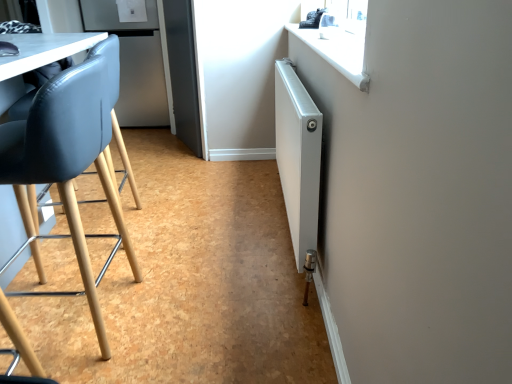
I want to click on satin silver refrigerator at upper left, so click(134, 62).

Locate an element on the screen. The width and height of the screenshot is (512, 384). satin silver refrigerator at upper left is located at coordinates (134, 62).

From the picture: Can you confirm if matte black chair at left is thinner than white metallic radiator at right?

In fact, matte black chair at left might be wider than white metallic radiator at right.

Find the location of `chair lying on the left of white metallic radiator at right`. chair lying on the left of white metallic radiator at right is located at coordinates (68, 159).

From the image's perspective, would you say matte black chair at left is positioned over white metallic radiator at right?

Incorrect, from the image's perspective, matte black chair at left is lower than white metallic radiator at right.

From a real-world perspective, is matte black chair at left above or below white metallic radiator at right?

matte black chair at left is above white metallic radiator at right.

How distant is satin silver refrigerator at upper left from white metallic radiator at right?

The distance of satin silver refrigerator at upper left from white metallic radiator at right is 6.09 feet.

Considering the relative sizes of satin silver refrigerator at upper left and white metallic radiator at right in the image provided, is satin silver refrigerator at upper left smaller than white metallic radiator at right?

Actually, satin silver refrigerator at upper left might be larger than white metallic radiator at right.

Is white metallic radiator at right a part of satin silver refrigerator at upper left?

Definitely not — white metallic radiator at right is not inside satin silver refrigerator at upper left.

Relative to white metallic radiator at right, is satin silver refrigerator at upper left in front or behind?

Visually, satin silver refrigerator at upper left is located behind white metallic radiator at right.

Is white metallic radiator at right not within satin silver refrigerator at upper left?

Yes.

Locate an element on the screen. This screenshot has width=512, height=384. radiator that is on the right side of satin silver refrigerator at upper left is located at coordinates (298, 157).

Is white metallic radiator at right far away from satin silver refrigerator at upper left?

Absolutely, white metallic radiator at right is distant from satin silver refrigerator at upper left.

Considering the sizes of white metallic radiator at right and satin silver refrigerator at upper left in the image, is white metallic radiator at right wider or thinner than satin silver refrigerator at upper left?

Clearly, white metallic radiator at right has less width compared to satin silver refrigerator at upper left.

Is white metallic radiator at right directly adjacent to matte black chair at left?

No, white metallic radiator at right is not in contact with matte black chair at left.

Considering the sizes of objects white metallic radiator at right and matte black chair at left in the image provided, who is taller, white metallic radiator at right or matte black chair at left?

matte black chair at left.

Find the location of a particular element. chair above the white metallic radiator at right (from a real-world perspective) is located at coordinates (68, 159).

Choose the correct answer: Is matte black chair at left inside satin silver refrigerator at upper left or outside it?

matte black chair at left is spatially situated outside satin silver refrigerator at upper left.

Considering the positions of objects matte black chair at left and satin silver refrigerator at upper left in the image provided, who is more to the right, matte black chair at left or satin silver refrigerator at upper left?

From the viewer's perspective, matte black chair at left appears more on the right side.

Considering the sizes of objects matte black chair at left and satin silver refrigerator at upper left in the image provided, who is shorter, matte black chair at left or satin silver refrigerator at upper left?

matte black chair at left.

Is matte black chair at left beside satin silver refrigerator at upper left?

They are not placed beside each other.

Which is more to the left, satin silver refrigerator at upper left or matte black chair at left?

satin silver refrigerator at upper left is more to the left.

Is satin silver refrigerator at upper left positioned far away from matte black chair at left?

Yes, satin silver refrigerator at upper left is far from matte black chair at left.

Based on the photo, from the image's perspective, does satin silver refrigerator at upper left appear lower than matte black chair at left?

No, from the image's perspective, satin silver refrigerator at upper left is not below matte black chair at left.

Does satin silver refrigerator at upper left have a lesser height compared to matte black chair at left?

Incorrect, the height of satin silver refrigerator at upper left does not fall short of that of matte black chair at left.

This screenshot has width=512, height=384. I want to click on radiator directly beneath the matte black chair at left (from a real-world perspective), so click(x=298, y=157).

The width and height of the screenshot is (512, 384). I want to click on radiator that appears on the right of satin silver refrigerator at upper left, so click(298, 157).

Which object lies further to the anchor point matte black chair at left, white metallic radiator at right or satin silver refrigerator at upper left?

satin silver refrigerator at upper left is positioned further to the anchor matte black chair at left.

Which object lies further to the anchor point white metallic radiator at right, satin silver refrigerator at upper left or matte black chair at left?

satin silver refrigerator at upper left is further to white metallic radiator at right.

When comparing their distances from satin silver refrigerator at upper left, does matte black chair at left or white metallic radiator at right seem closer?

Among the two, white metallic radiator at right is located nearer to satin silver refrigerator at upper left.

Estimate the real-world distances between objects in this image. Which object is further from satin silver refrigerator at upper left, white metallic radiator at right or matte black chair at left?

matte black chair at left.

Estimate the real-world distances between objects in this image. Which object is further from white metallic radiator at right, matte black chair at left or satin silver refrigerator at upper left?

satin silver refrigerator at upper left.

Based on the photo, when comparing their distances from matte black chair at left, does satin silver refrigerator at upper left or white metallic radiator at right seem closer?

white metallic radiator at right is positioned closer to the anchor matte black chair at left.

You are a GUI agent. You are given a task and a screenshot of the screen. Output one action in this format:
    pyautogui.click(x=<x>, y=<y>)
    Task: Click on the radiator between matte black chair at left and satin silver refrigerator at upper left from front to back
    
    Given the screenshot: What is the action you would take?
    pyautogui.click(x=298, y=157)